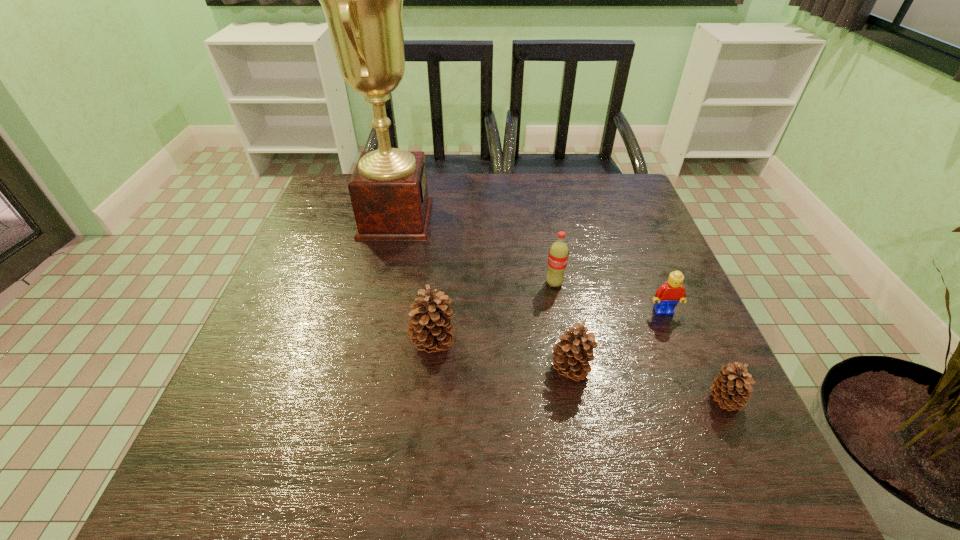
Identify the location of vacant space positioned 0.060m on the plaque of the tallest object. (452, 219).

What are the coordinates of `vacant space situated on the front-facing side of the Lego` in the screenshot? It's located at (691, 379).

Where is `vacant area situated 0.230m on the left of the fifth nearest object`? The height and width of the screenshot is (540, 960). vacant area situated 0.230m on the left of the fifth nearest object is located at coordinates (446, 284).

What are the coordinates of `object at the far edge` in the screenshot? It's located at (362, 0).

Image resolution: width=960 pixels, height=540 pixels. In order to click on object that is at the near edge in this screenshot , I will do `click(731, 388)`.

Where is `object that is at the left edge`? Image resolution: width=960 pixels, height=540 pixels. object that is at the left edge is located at coordinates (362, 0).

Where is `pinecone located at the right edge`? pinecone located at the right edge is located at coordinates (731, 388).

Where is `Lego present at the right edge`? Lego present at the right edge is located at coordinates (667, 296).

Identify the location of object that is at the far left corner. The image size is (960, 540). (362, 0).

You are a GUI agent. You are given a task and a screenshot of the screen. Output one action in this format:
    pyautogui.click(x=<x>, y=<y>)
    Task: Click on the object that is at the near right corner
    
    Given the screenshot: What is the action you would take?
    pyautogui.click(x=731, y=388)